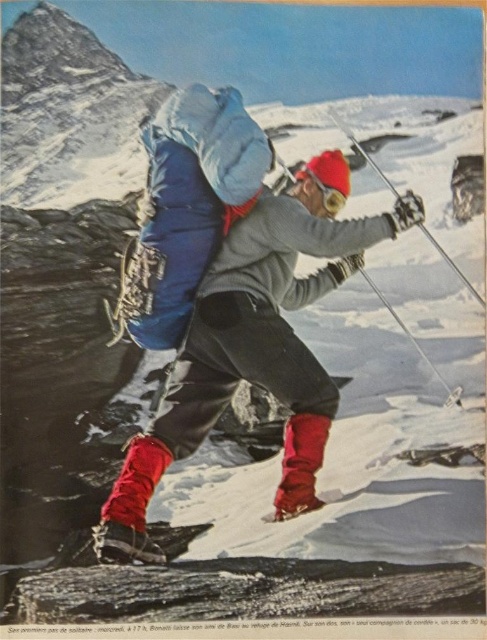
You are standing at the camera position and want to reach the point marked at coordinates point (268, 316). If you can walk 10 meters in one minute, how long will it take you to reach that point?

The distance between you and point (268, 316) is 10.43 meters. At a walking speed of 10 meters per minute, it would take approximately 1.043 minutes, which is roughly 1 minute and 2.5 seconds to reach the point.

You are planning to carry both the matte blue backpack at center and the metallic silver ski pole at upper right while climbing. Which item is shorter in height?

The matte blue backpack at center is not as tall as the metallic silver ski pole at upper right, so the backpack is shorter in height.